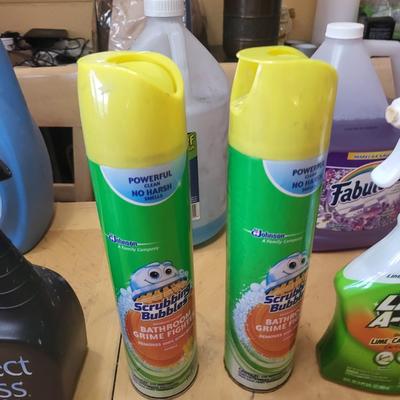
What are the coordinates of `tan countertop` in the screenshot? It's located at (213, 310), (322, 292), (85, 272).